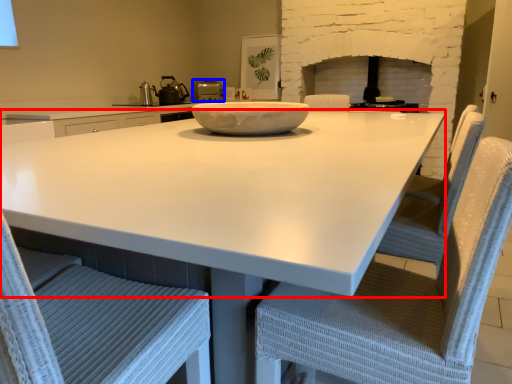
Question: Which object is closer to the camera taking this photo, countertop (highlighted by a red box) or kitchen appliance (highlighted by a blue box)?

Choices:
 (A) countertop
 (B) kitchen appliance

Answer: (A)